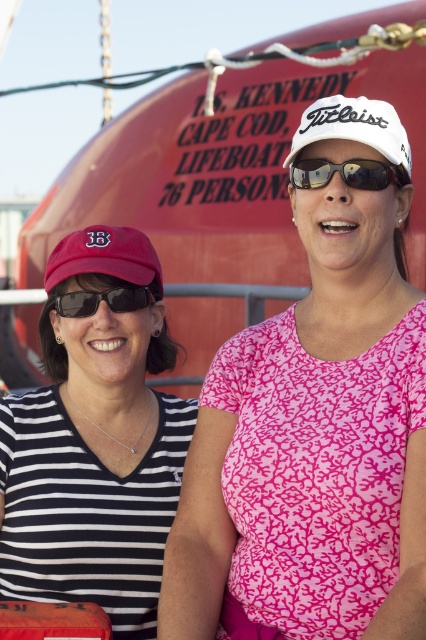
Question: Is pink printed shirt at center to the right of white matte baseball cap at upper center from the viewer's perspective?

Choices:
 (A) yes
 (B) no

Answer: (B)

Question: Does matte black sunglasses at center appear on the right side of matte black sunglasses at left?

Choices:
 (A) yes
 (B) no

Answer: (A)

Question: Does pink printed shirt at center appear on the right side of matte red baseball cap at left?

Choices:
 (A) no
 (B) yes

Answer: (B)

Question: Which of the following is the farthest from the observer?

Choices:
 (A) (25, 440)
 (B) (106, 304)
 (C) (388, 307)

Answer: (A)

Question: Which object is positioned closest to the matte black sunglasses at center?

Choices:
 (A) matte black sunglasses at left
 (B) black striped shirt at upper left
 (C) pink printed shirt at center

Answer: (C)

Question: Among these points, which one is nearest to the camera?

Choices:
 (A) (132, 310)
 (B) (77, 483)

Answer: (B)